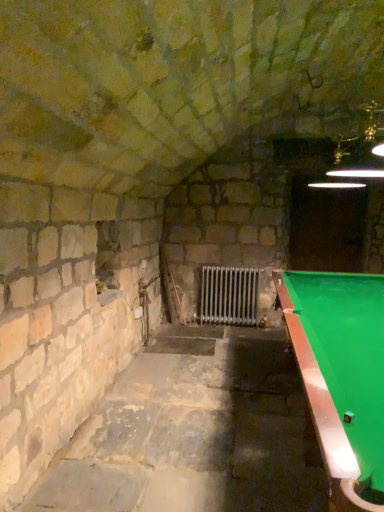
Find the location of a particular element. Image resolution: width=384 pixels, height=512 pixels. green felt pool table at right is located at coordinates (342, 375).

What do you see at coordinates (342, 375) in the screenshot? The image size is (384, 512). I see `green felt pool table at right` at bounding box center [342, 375].

Measure the distance between point [243,308] and camera.

The distance of point [243,308] from camera is 5.22 meters.

Locate an element on the screen. The width and height of the screenshot is (384, 512). metallic silver radiator at center is located at coordinates (229, 295).

Describe the element at coordinates (229, 295) in the screenshot. This screenshot has width=384, height=512. I see `metallic silver radiator at center` at that location.

You are a GUI agent. You are given a task and a screenshot of the screen. Output one action in this format:
    pyautogui.click(x=<x>, y=<y>)
    Task: Click on the green felt pool table at right
    This screenshot has height=512, width=384.
    Given the screenshot: What is the action you would take?
    pyautogui.click(x=342, y=375)

Visually, is green felt pool table at right positioned to the left or to the right of metallic silver radiator at center?

In the image, green felt pool table at right appears on the right side of metallic silver radiator at center.

Relative to metallic silver radiator at center, is green felt pool table at right in front or behind?

green felt pool table at right is in front of metallic silver radiator at center.

Which is behind, point (354, 437) or point (231, 293)?

The point (231, 293) is farther.

From the image's perspective, who appears lower, green felt pool table at right or metallic silver radiator at center?

green felt pool table at right.

From a real-world perspective, who is located higher, green felt pool table at right or metallic silver radiator at center?

green felt pool table at right, from a real-world perspective.

Can you confirm if green felt pool table at right is wider than metallic silver radiator at center?

Yes, green felt pool table at right is wider than metallic silver radiator at center.

Considering the sizes of green felt pool table at right and metallic silver radiator at center in the image, is green felt pool table at right taller or shorter than metallic silver radiator at center?

Clearly, green felt pool table at right is taller compared to metallic silver radiator at center.

Is green felt pool table at right smaller than metallic silver radiator at center?

No, green felt pool table at right is not smaller than metallic silver radiator at center.

Is green felt pool table at right spatially inside metallic silver radiator at center, or outside of it?

green felt pool table at right is not inside metallic silver radiator at center, it's outside.

Would you say green felt pool table at right is a long distance from metallic silver radiator at center?

Yes, green felt pool table at right and metallic silver radiator at center are quite far apart.

Is green felt pool table at right looking in the opposite direction of metallic silver radiator at center?

No.

How distant is green felt pool table at right from metallic silver radiator at center?

2.70 meters.

Locate an element on the screen. radiator below the green felt pool table at right (from a real-world perspective) is located at coordinates (229, 295).

Does metallic silver radiator at center appear on the left side of green felt pool table at right?

Correct, you'll find metallic silver radiator at center to the left of green felt pool table at right.

Is metallic silver radiator at center closer to camera compared to green felt pool table at right?

No, the depth of metallic silver radiator at center is greater than that of green felt pool table at right.

Which point is more forward, (x=210, y=322) or (x=341, y=308)?

The point (x=341, y=308) is closer to the camera.

From the image's perspective, is metallic silver radiator at center over green felt pool table at right?

Yes, from the image's perspective, metallic silver radiator at center is on top of green felt pool table at right.

From a real-world perspective, is metallic silver radiator at center positioned under green felt pool table at right based on gravity?

Yes.

Which object is wider, metallic silver radiator at center or green felt pool table at right?

With larger width is green felt pool table at right.

Between metallic silver radiator at center and green felt pool table at right, which one has less height?

metallic silver radiator at center is shorter.

In terms of size, does metallic silver radiator at center appear bigger or smaller than green felt pool table at right?

Clearly, metallic silver radiator at center is smaller in size than green felt pool table at right.

Choose the correct answer: Is metallic silver radiator at center inside green felt pool table at right or outside it?

metallic silver radiator at center is outside green felt pool table at right.

Is metallic silver radiator at center next to green felt pool table at right and touching it?

No, metallic silver radiator at center is not touching green felt pool table at right.

Is metallic silver radiator at center facing away from green felt pool table at right?

That's not correct — metallic silver radiator at center is not looking away from green felt pool table at right.

What's the angular difference between metallic silver radiator at center and green felt pool table at right's facing directions?

90.9 degrees separate the facing orientations of metallic silver radiator at center and green felt pool table at right.

Find the location of a particular element. The width and height of the screenshot is (384, 512). billiard table in front of the metallic silver radiator at center is located at coordinates (342, 375).

Where is `billiard table above the metallic silver radiator at center (from a real-world perspective)`? billiard table above the metallic silver radiator at center (from a real-world perspective) is located at coordinates (342, 375).

Where is `billiard table in front of the metallic silver radiator at center`? This screenshot has width=384, height=512. billiard table in front of the metallic silver radiator at center is located at coordinates (342, 375).